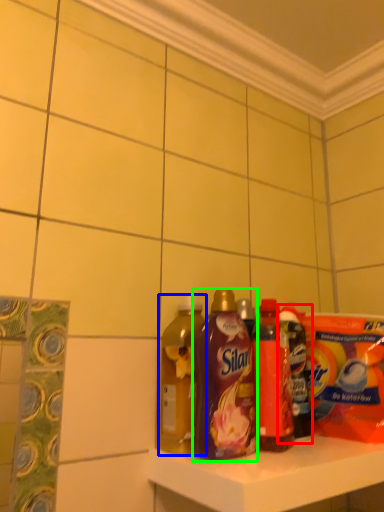
Question: Estimate the real-world distances between objects in this image. Which object is farther from bottle (highlighted by a red box), bottle (highlighted by a blue box) or bottle (highlighted by a green box)?

Choices:
 (A) bottle
 (B) bottle

Answer: (A)